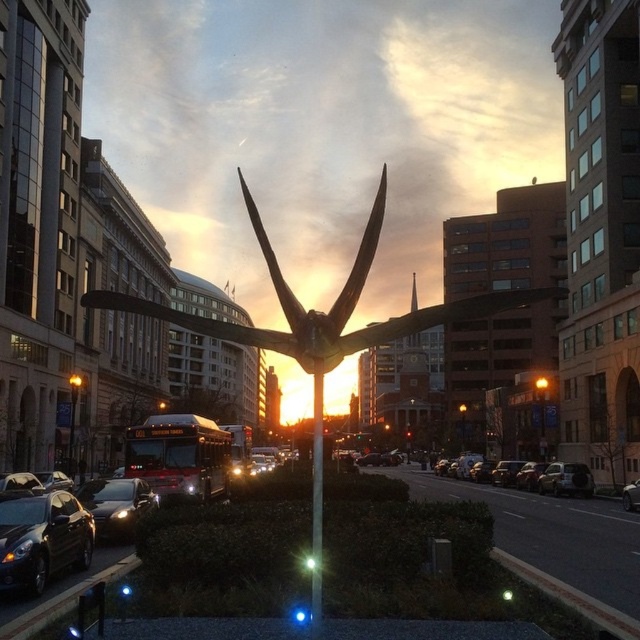
Can you confirm if shiny black sedan at lower left is positioned to the left of shiny silver car at center?

Yes, shiny black sedan at lower left is to the left of shiny silver car at center.

Between point (36, 560) and point (632, 508), which one is positioned in front?

Point (36, 560) is in front.

Identify the location of shiny black sedan at lower left. The height and width of the screenshot is (640, 640). (42, 540).

Does shiny black sedan at lower left have a larger size compared to shiny black sedan at center-left?

Yes, shiny black sedan at lower left is bigger than shiny black sedan at center-left.

Can you confirm if shiny black sedan at lower left is positioned to the right of shiny black sedan at center-left?

Yes, shiny black sedan at lower left is to the right of shiny black sedan at center-left.

What are the coordinates of `shiny black sedan at lower left` in the screenshot? It's located at (42, 540).

Which is behind, point (314, 403) or point (636, 486)?

Point (636, 486)

Between metallic pole at center and shiny silver car at center, which one appears on the right side from the viewer's perspective?

shiny silver car at center is more to the right.

This screenshot has width=640, height=640. Describe the element at coordinates (316, 504) in the screenshot. I see `metallic pole at center` at that location.

Find the location of a particular element. metallic pole at center is located at coordinates (316, 504).